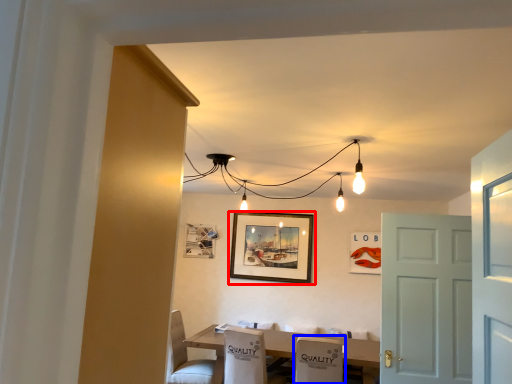
Question: Which object appears farthest to the camera in this image, picture frame (highlighted by a red box) or armchair (highlighted by a blue box)?

Choices:
 (A) picture frame
 (B) armchair

Answer: (A)